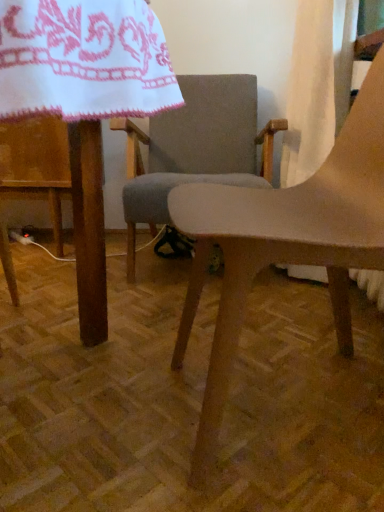
The height and width of the screenshot is (512, 384). In order to click on vacant space behind matte wood chair at center, the 1th chair when ordered from front to back in this screenshot , I will do `click(284, 322)`.